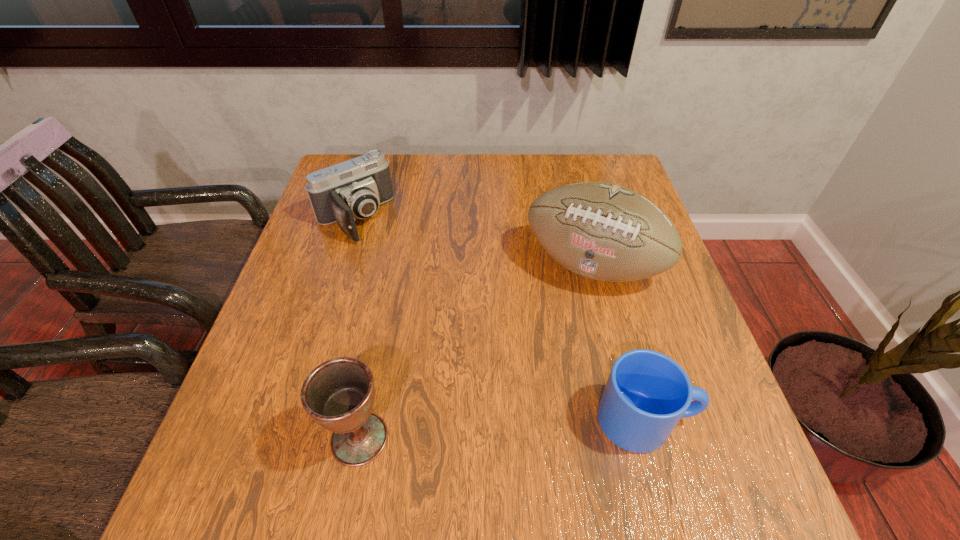
You are a GUI agent. You are given a task and a screenshot of the screen. Output one action in this format:
    pyautogui.click(x=<x>, y=<y>)
    Task: Click on the free area in between the chalice and the tallest object
    
    Given the screenshot: What is the action you would take?
    pyautogui.click(x=476, y=352)

I want to click on vacant point located between the shortest object and the camera, so click(x=500, y=319).

This screenshot has height=540, width=960. I want to click on vacant space that's between the mug and the camera, so click(x=500, y=319).

You are a GUI agent. You are given a task and a screenshot of the screen. Output one action in this format:
    pyautogui.click(x=<x>, y=<y>)
    Task: Click on the empty location between the camera and the chalice
    The height and width of the screenshot is (540, 960).
    Given the screenshot: What is the action you would take?
    pyautogui.click(x=357, y=328)

This screenshot has height=540, width=960. In order to click on vacant space that's between the football (American) and the chalice in this screenshot , I will do 476,352.

Where is `free space that is in between the camera and the chalice`? free space that is in between the camera and the chalice is located at coordinates (357, 328).

Locate an element on the screen. Image resolution: width=960 pixels, height=540 pixels. the third closest object relative to the camera is located at coordinates (647, 393).

Identify which object is located as the second nearest to the tallest object. Please provide its 2D coordinates. Your answer should be formatted as a tuple, i.e. [(x, y)], where the tuple contains the x and y coordinates of a point satisfying the conditions above.

[(354, 189)]

Image resolution: width=960 pixels, height=540 pixels. Identify the location of free spot that satisfies the following two spatial constraints: 1. on the front side of the football (American); 2. on the side of the mug with the handle. (632, 420).

Where is `free space that satisfies the following two spatial constraints: 1. on the back side of the chalice; 2. on the side of the shortest object with the handle`? This screenshot has width=960, height=540. free space that satisfies the following two spatial constraints: 1. on the back side of the chalice; 2. on the side of the shortest object with the handle is located at coordinates (363, 420).